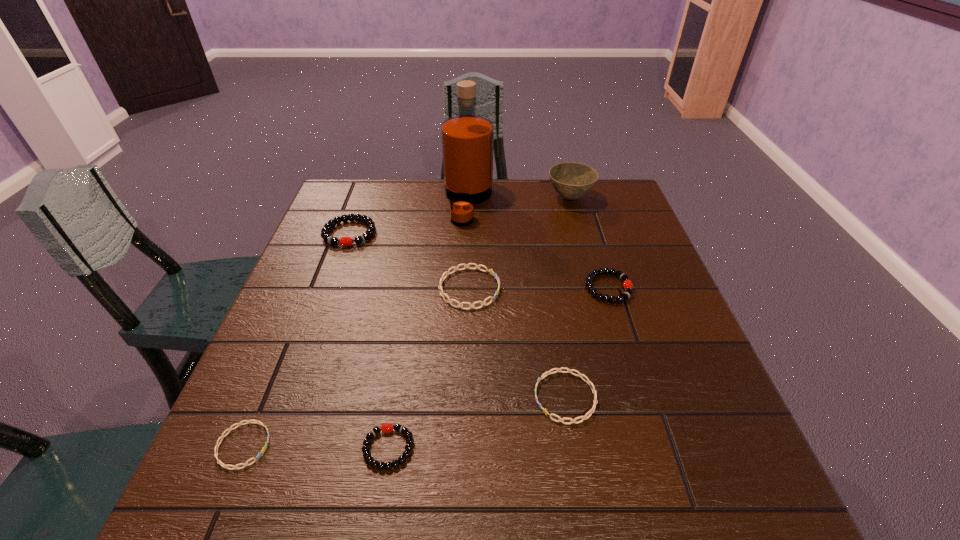
You are a GUI agent. You are given a task and a screenshot of the screen. Output one action in this format:
    pyautogui.click(x=<x>, y=<y>)
    Task: Click on the object that is positioned at the near left corner
    
    Given the screenshot: What is the action you would take?
    pyautogui.click(x=263, y=450)

Where is `object situated at the far right corner`? The height and width of the screenshot is (540, 960). object situated at the far right corner is located at coordinates (571, 180).

Locate an element on the screen. The height and width of the screenshot is (540, 960). vacant position at the far edge of the desktop is located at coordinates (478, 217).

Find the location of a particular element. The image size is (960, 540). vacant space at the near edge is located at coordinates (304, 504).

Where is `vacant region at the left edge of the desktop`? This screenshot has height=540, width=960. vacant region at the left edge of the desktop is located at coordinates (316, 417).

Find the location of a particular element. This screenshot has height=540, width=960. free space at the right edge of the desktop is located at coordinates (657, 377).

In the image, there is a desktop. Where is `vacant space at the far right corner`? The height and width of the screenshot is (540, 960). vacant space at the far right corner is located at coordinates (588, 213).

Locate an element on the screen. This screenshot has height=540, width=960. vacant area that lies between the biggest blue bracelet and the second farthest black bracelet is located at coordinates (539, 288).

At what (x,y) coordinates should I click in order to perform the action: click on vacant space that's between the biggest black bracelet and the shortest bracelet. Please return your answer as a coordinate pair (x, y). This screenshot has width=960, height=540. Looking at the image, I should click on pos(297,339).

You are a GUI agent. You are given a task and a screenshot of the screen. Output one action in this format:
    pyautogui.click(x=<x>, y=<y>)
    Task: Click on the empty space that is in between the liquor and the farthest blue bracelet
    
    Given the screenshot: What is the action you would take?
    pyautogui.click(x=468, y=245)